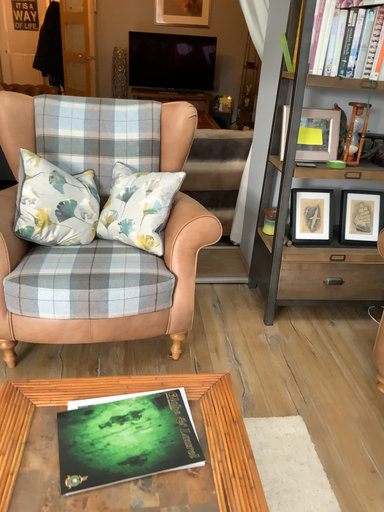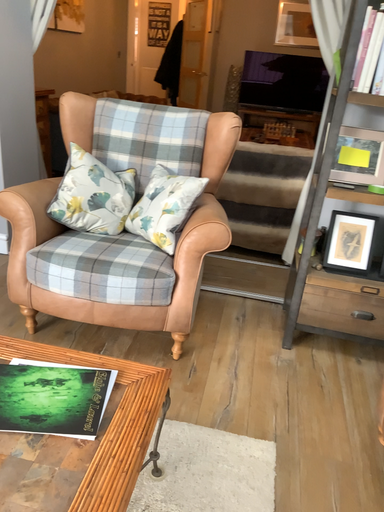
Question: Which way did the camera rotate in the video?

Choices:
 (A) rotated right
 (B) rotated left

Answer: (B)